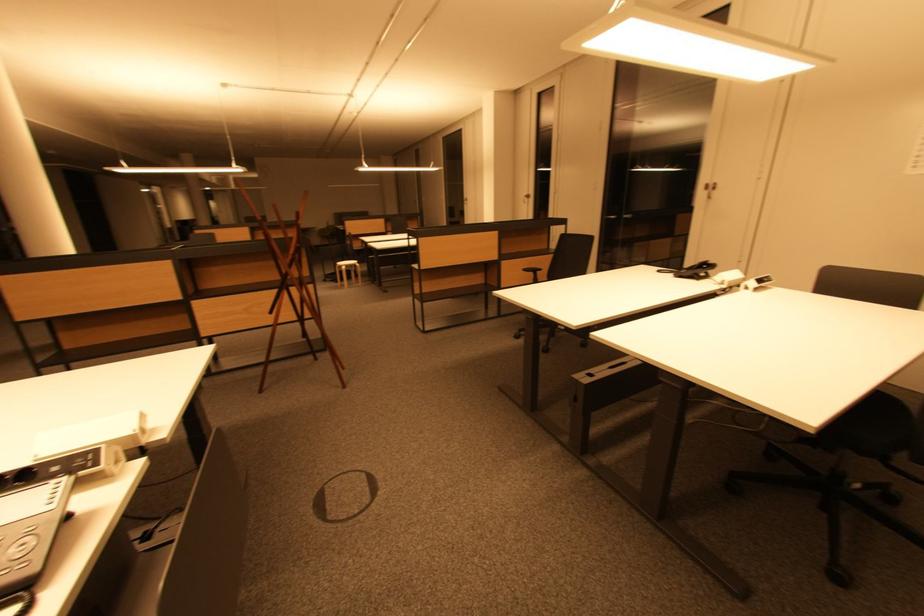
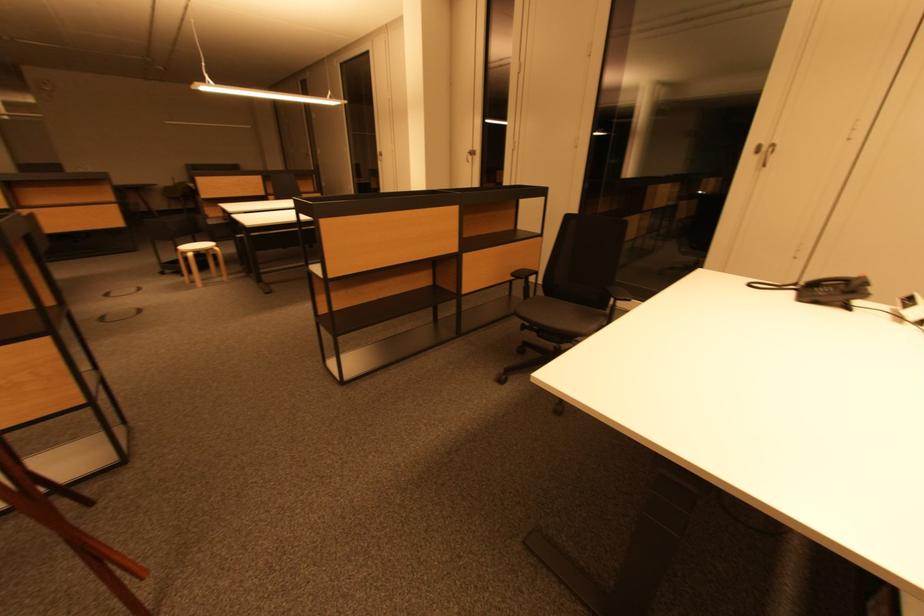
Locate, in the second image, the point that corresponds to pixel 347 270 in the first image.

(193, 256)